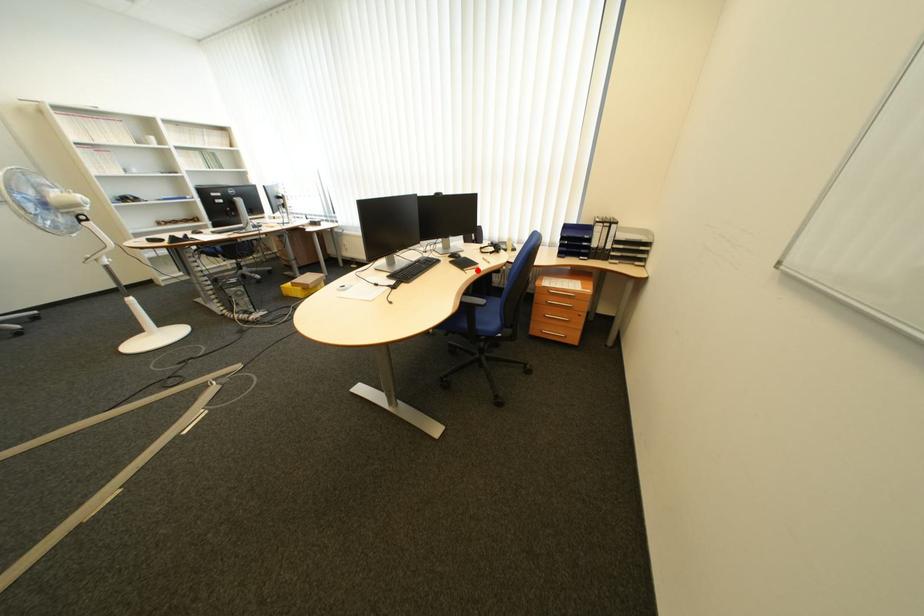
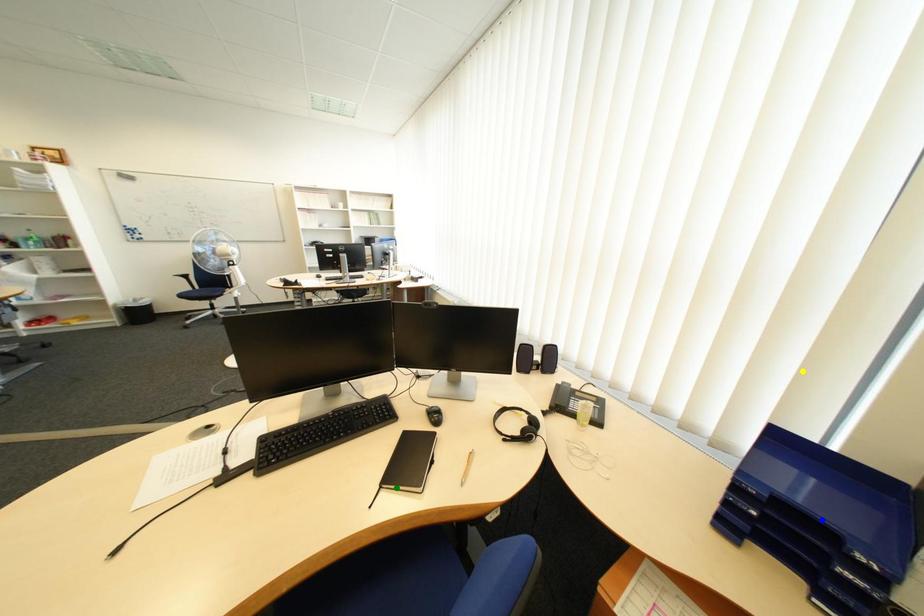
Question: I am providing you with two images of the same scene from different viewpoints. A red point is marked on the first image. You are given multiple points on the second image. Which spot in image 2 lines up with the point in image 1?

Choices:
 (A) yellow point
 (B) blue point
 (C) green point

Answer: (C)